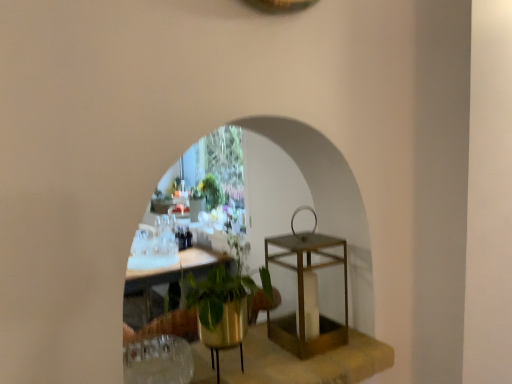
What do you see at coordinates (303, 295) in the screenshot? I see `gold metallic table at center` at bounding box center [303, 295].

What is the approximate width of gold metallic table at center?

gold metallic table at center is 22.27 centimeters wide.

You are a GUI agent. You are given a task and a screenshot of the screen. Output one action in this format:
    pyautogui.click(x=<x>, y=<y>)
    Task: Click on the gold metallic table at center
    This screenshot has height=384, width=512.
    Given the screenshot: What is the action you would take?
    pyautogui.click(x=303, y=295)

Where is `gold metallic table at center`? The image size is (512, 384). gold metallic table at center is located at coordinates pos(303,295).